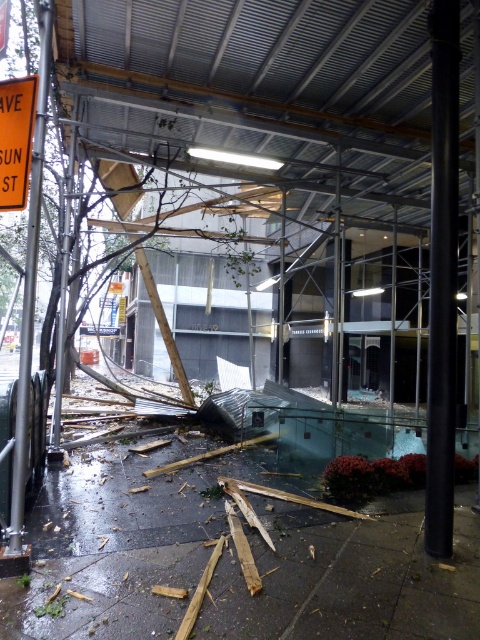
Question: Among these objects, which one is farthest from the camera?

Choices:
 (A) black metal pole at right
 (B) green metallic pole at left

Answer: (A)

Question: Does wet concrete pavement at lower center have a lesser width compared to black metal pole at right?

Choices:
 (A) yes
 (B) no

Answer: (B)

Question: Does black metal pole at right appear on the left side of green metallic pole at left?

Choices:
 (A) no
 (B) yes

Answer: (A)

Question: Does green metallic pole at left have a larger size compared to orange reflective plastic sign at upper left?

Choices:
 (A) no
 (B) yes

Answer: (B)

Question: Which object is farther from the camera taking this photo?

Choices:
 (A) wet concrete pavement at lower center
 (B) orange reflective plastic sign at upper left
 (C) black metal pole at right

Answer: (C)

Question: Among these points, which one is nearest to the camera?

Choices:
 (A) (14, 112)
 (B) (166, 636)

Answer: (B)